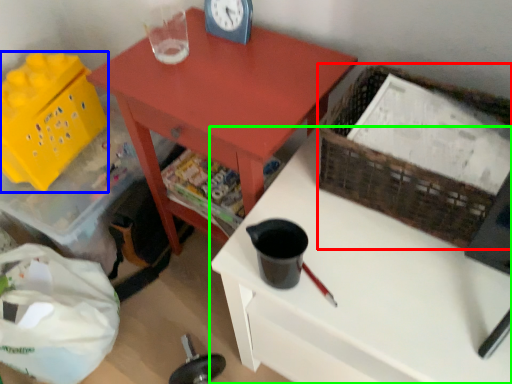
Question: Estimate the real-world distances between objects in this image. Which object is closer to basket (highlighted by a red box), basket (highlighted by a blue box) or desk (highlighted by a green box)?

Choices:
 (A) basket
 (B) desk

Answer: (B)